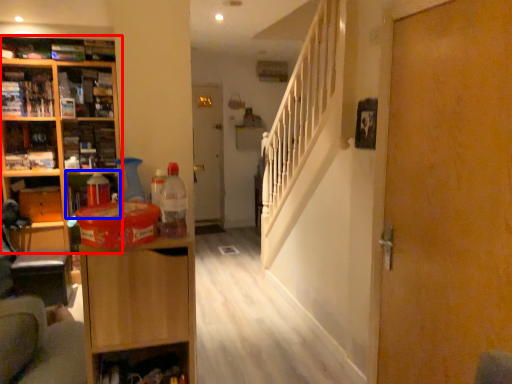
Question: Which point is further to the camera, cabinetry (highlighted by a red box) or cabinet (highlighted by a blue box)?

Choices:
 (A) cabinetry
 (B) cabinet

Answer: (A)